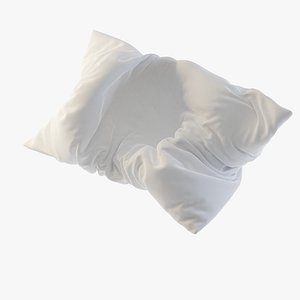
The image size is (300, 300). What are the coordinates of `to the right of the pillow` in the screenshot? It's located at (299, 123).